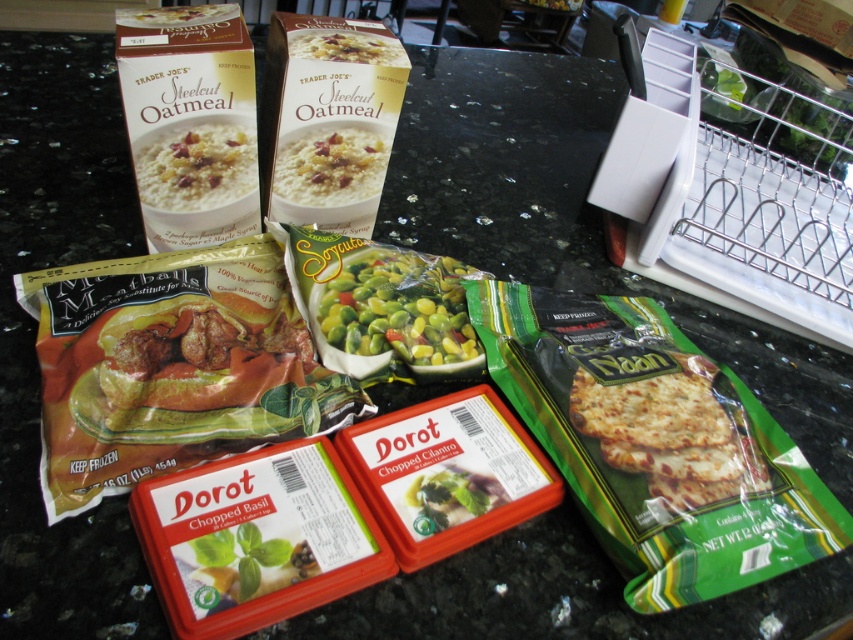
Question: Is white matte oatmeal at upper left smaller than white matte oatmeal at center?

Choices:
 (A) no
 (B) yes

Answer: (A)

Question: Which point is closer to the camera taking this photo?

Choices:
 (A) (376, 304)
 (B) (310, 195)
 (C) (326, 36)
 (D) (177, 179)

Answer: (A)

Question: Which is farther from the white matte oatmeal at upper left?

Choices:
 (A) white matte oatmeal at center
 (B) green matte frozen peas at center

Answer: (B)

Question: Considering the real-world distances, which object is farthest from the white matte steel cut oatmeal at upper center?

Choices:
 (A) white matte oatmeal at center
 (B) white matte oatmeal at upper left

Answer: (B)

Question: From the image, what is the correct spatial relationship of green matte frozen peas at center in relation to white matte oatmeal at center?

Choices:
 (A) left
 (B) right

Answer: (B)

Question: Can you confirm if white matte oatmeal at upper left is smaller than white matte steel cut oatmeal at upper center?

Choices:
 (A) yes
 (B) no

Answer: (B)